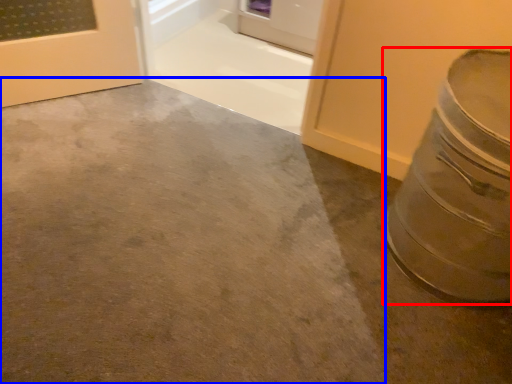
Question: Which object is further to the camera taking this photo, crock pot (highlighted by a red box) or concrete (highlighted by a blue box)?

Choices:
 (A) crock pot
 (B) concrete

Answer: (A)